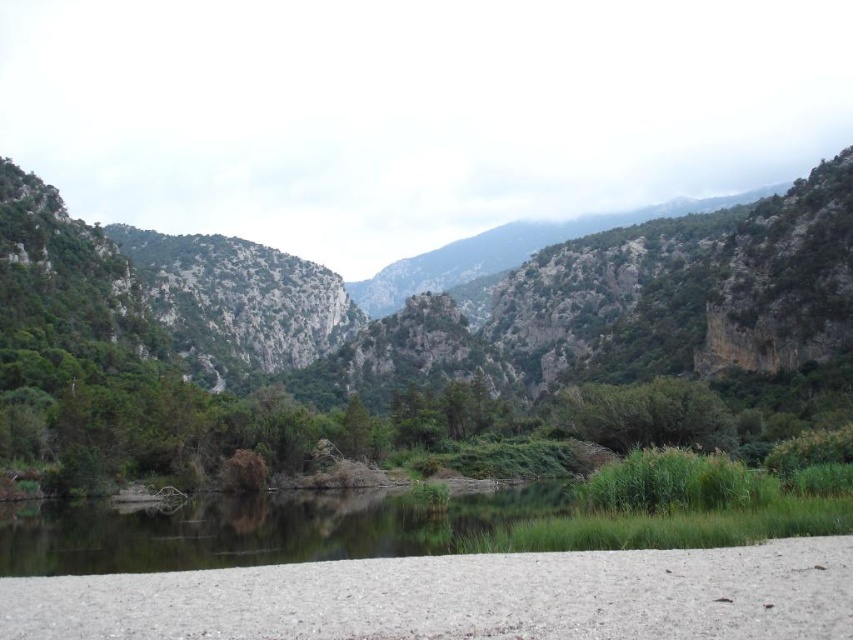
Does clear water at center have a greater width compared to green leafy bush at center?

Correct, the width of clear water at center exceeds that of green leafy bush at center.

Does clear water at center have a smaller size compared to green leafy bush at center?

Indeed, clear water at center has a smaller size compared to green leafy bush at center.

Between point (515, 490) and point (654, 387), which one is positioned in front?

Point (515, 490) is in front.

Find the location of a particular element. clear water at center is located at coordinates (258, 531).

Is point (387, 572) behind point (283, 522)?

No, it is in front of (283, 522).

From the picture: Is white gravel at lower center wider than clear water at center?

No, white gravel at lower center is not wider than clear water at center.

The width and height of the screenshot is (853, 640). Find the location of `white gravel at lower center`. white gravel at lower center is located at coordinates click(x=461, y=596).

Where is `white gravel at lower center`? The height and width of the screenshot is (640, 853). white gravel at lower center is located at coordinates (461, 596).

Does white gravel at lower center come behind green leafy bush at center?

That is False.

I want to click on white gravel at lower center, so click(461, 596).